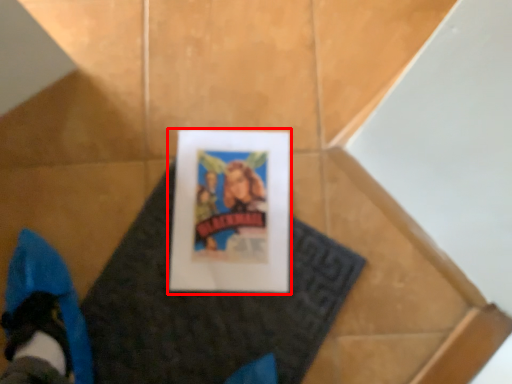
Question: From the image, what is the correct spatial relationship of picture frame (annotated by the red box) in relation to blanket?

Choices:
 (A) left
 (B) right

Answer: (B)